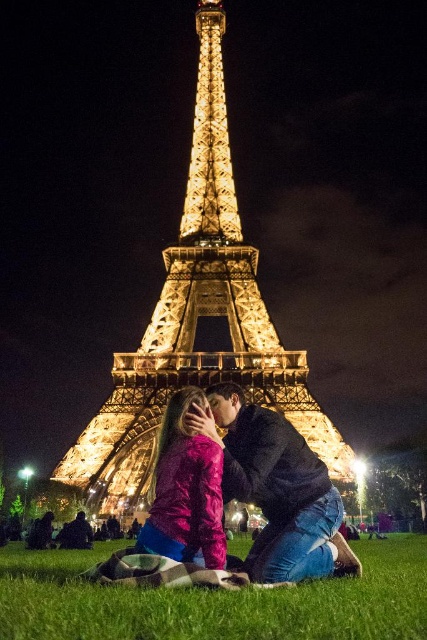
You are standing at the center of the image and want to place a small picnic basket on the green grass at lower center. According to the coordinates provided, where exactly should you place it?

You should place the picnic basket at the coordinates point (215, 600) where the green grass at lower center is located.

You are a photographer positioned at the edge of the grassy area wanting to capture a photo of the couple. To ensure both the green grass at lower center and the black matte jacket at center are in the frame, should you adjust your camera to the left or right?

The green grass at lower center is to the left of the black matte jacket at center, so you should adjust your camera to the left to include both objects in the frame.

You are a photographer planning to take a closeup shot of the couple. You have a camera with a lens that can focus on objects within a 30 cm width. If you want to capture both the black matte jacket at center and the shiny pink jacket at center in the same frame, will the width difference between them affect your ability to do so?

The black matte jacket at center is wider than the shiny pink jacket at center, so the width difference will not affect your ability to capture both in the same frame since the camera lens can focus on objects within a 30 cm width.